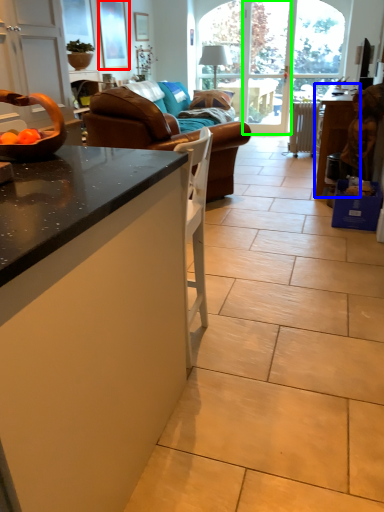
Question: Which is nearer to the picture frame (highlighted by a red box)? table (highlighted by a blue box) or screen door (highlighted by a green box).

Choices:
 (A) table
 (B) screen door

Answer: (B)